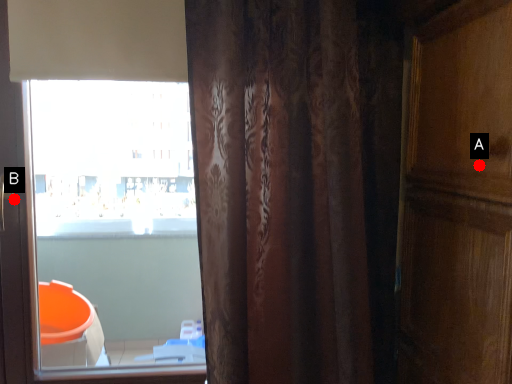
Question: Two points are circled on the image, labeled by A and B beside each circle. Which point is farther from the camera taking this photo?

Choices:
 (A) A is further
 (B) B is further

Answer: (B)